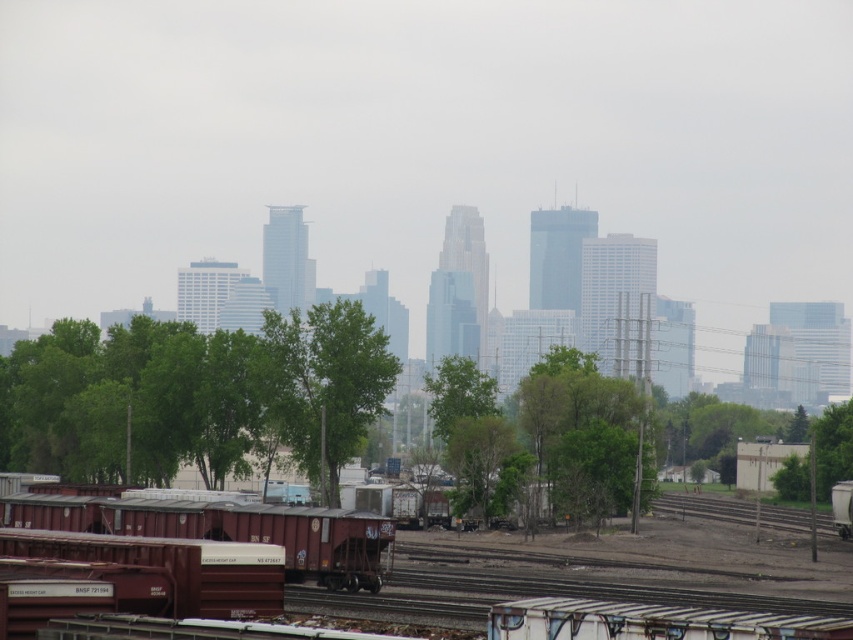
You are standing at the center of the railway yard in the cityscape image. You want to take a photo of the green leafy tree at lower center. Which direction should you face to capture it in your view?

The green leafy tree at lower center is located at point coordinates of (195, 397). Since the coordinates are in the lower center area, you should face towards the lower center direction to capture it in your view.